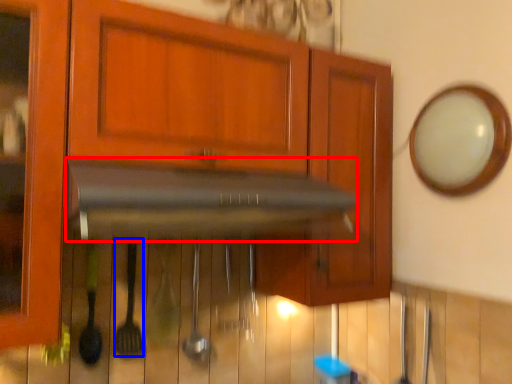
Question: Which object is further to the camera taking this photo, vent (highlighted by a red box) or silverware (highlighted by a blue box)?

Choices:
 (A) vent
 (B) silverware

Answer: (B)